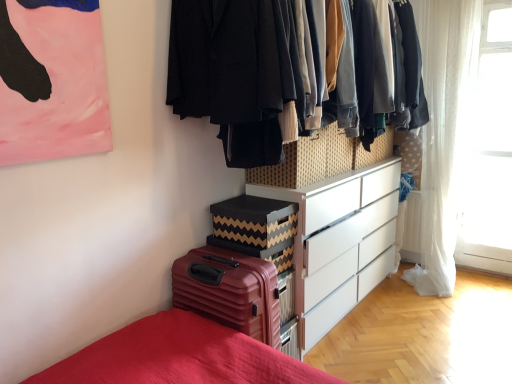
The width and height of the screenshot is (512, 384). What are the coordinates of `free space in front of white sheer curtain at right` in the screenshot? It's located at (448, 300).